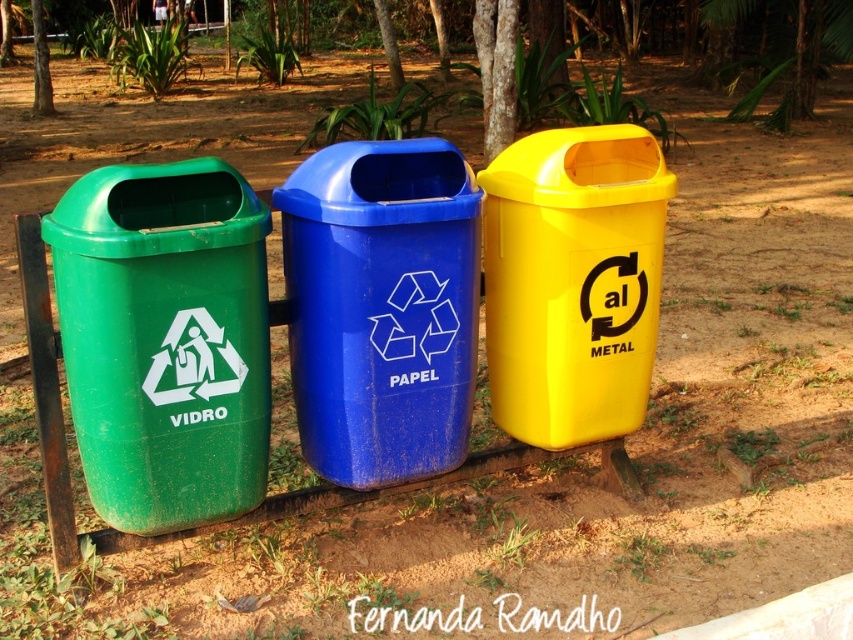
Does green plastic/recycled bin at left appear under brown rough bark at center?

Correct, green plastic/recycled bin at left is located below brown rough bark at center.

Based on the photo, who is lower down, green plastic/recycled bin at left or brown rough bark at center?

green plastic/recycled bin at left is below.

Who is more distant from viewer, (109, 477) or (508, 145)?

Positioned behind is point (508, 145).

Locate an element on the screen. The height and width of the screenshot is (640, 853). green plastic/recycled bin at left is located at coordinates (165, 339).

Is green plastic bin at left above green plastic tree at upper left?

Incorrect, green plastic bin at left is not positioned above green plastic tree at upper left.

Between green plastic bin at left and green plastic tree at upper left, which one is positioned higher?

green plastic tree at upper left

At what (x,y) coordinates should I click in order to perform the action: click on green plastic bin at left. Please return your answer as a coordinate pair (x, y). The height and width of the screenshot is (640, 853). Looking at the image, I should click on (465, 296).

Between green plastic bin at left and brown rough bark at center, which one is positioned lower?

green plastic bin at left is lower down.

Is green plastic bin at left above brown rough bark at center?

Incorrect, green plastic bin at left is not positioned above brown rough bark at center.

What do you see at coordinates (465, 296) in the screenshot?
I see `green plastic bin at left` at bounding box center [465, 296].

I want to click on green plastic bin at left, so click(465, 296).